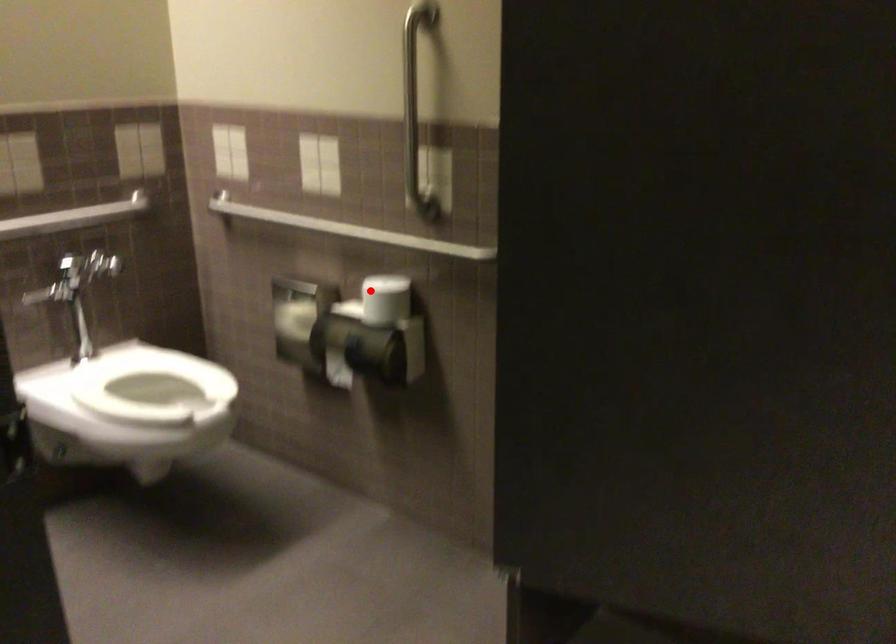
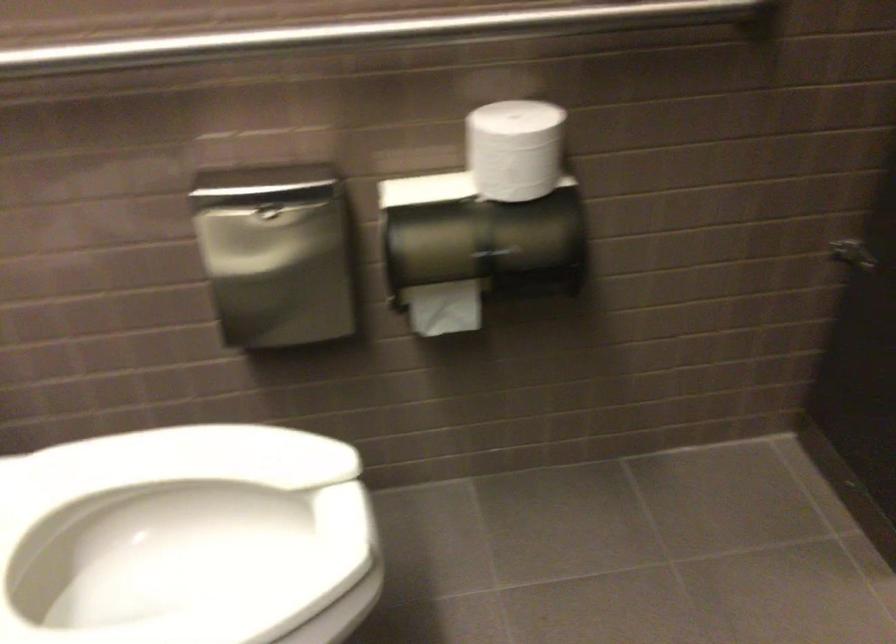
Question: I am providing you with two images of the same scene from different viewpoints. A red point is shown in image1. For the corresponding object point in image2, is it positioned nearer or farther from the camera?

Choices:
 (A) Nearer
 (B) Farther

Answer: (A)